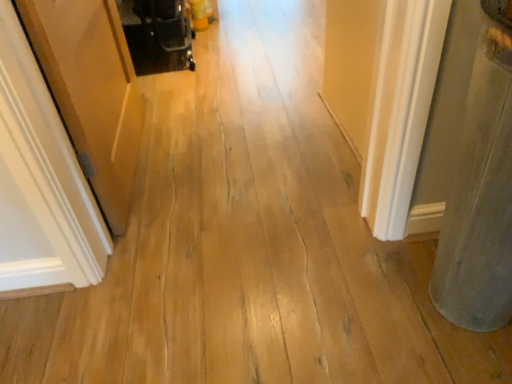
Question: Can you confirm if gray felt pillow at right is taller than wooden door at left?

Choices:
 (A) no
 (B) yes

Answer: (B)

Question: Is gray felt pillow at right outside of wooden door at left?

Choices:
 (A) no
 (B) yes

Answer: (B)

Question: Is the position of gray felt pillow at right more distant than that of wooden door at left?

Choices:
 (A) yes
 (B) no

Answer: (B)

Question: Does gray felt pillow at right have a lesser height compared to wooden door at left?

Choices:
 (A) yes
 (B) no

Answer: (B)

Question: Is gray felt pillow at right aimed at wooden door at left?

Choices:
 (A) no
 (B) yes

Answer: (A)

Question: Based on their sizes in the image, would you say gray felt pillow at right is bigger or smaller than black plastic baby carriage at upper left?

Choices:
 (A) big
 (B) small

Answer: (A)

Question: Do you think gray felt pillow at right is within black plastic baby carriage at upper left, or outside of it?

Choices:
 (A) outside
 (B) inside

Answer: (A)

Question: From a real-world perspective, is gray felt pillow at right physically located above or below black plastic baby carriage at upper left?

Choices:
 (A) below
 (B) above

Answer: (B)

Question: In the image, is gray felt pillow at right on the left side or the right side of black plastic baby carriage at upper left?

Choices:
 (A) left
 (B) right

Answer: (B)

Question: Is gray felt pillow at right taller or shorter than wooden door at left?

Choices:
 (A) short
 (B) tall

Answer: (B)

Question: Is gray felt pillow at right to the left or to the right of wooden door at left in the image?

Choices:
 (A) right
 (B) left

Answer: (A)

Question: Is gray felt pillow at right in front of or behind wooden door at left in the image?

Choices:
 (A) front
 (B) behind

Answer: (A)

Question: Does point (482, 220) appear closer or farther from the camera than point (82, 266)?

Choices:
 (A) closer
 (B) farther

Answer: (A)

Question: Is wooden door at left bigger or smaller than black plastic baby carriage at upper left?

Choices:
 (A) big
 (B) small

Answer: (A)

Question: Visually, is wooden door at left positioned to the left or to the right of black plastic baby carriage at upper left?

Choices:
 (A) right
 (B) left

Answer: (B)